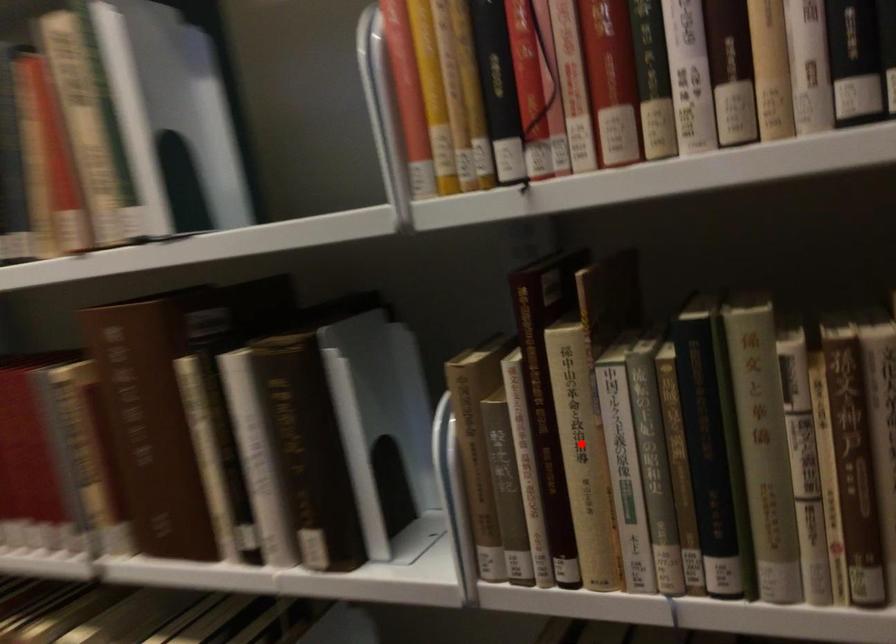
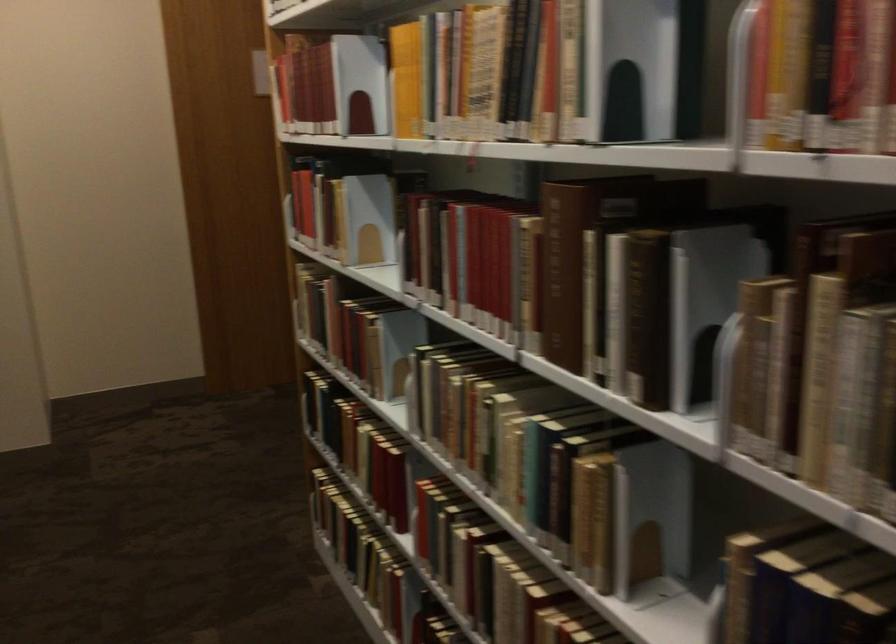
Question: I am providing you with two images of the same scene from different viewpoints. In image1, a red point is highlighted. Considering the same 3D point in image2, which of the following is correct?

Choices:
 (A) It is closer
 (B) It is farther

Answer: (B)